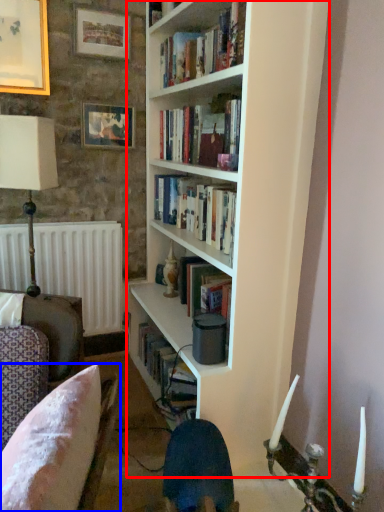
Question: Which object is closer to the camera taking this photo, bookcase (highlighted by a red box) or chair (highlighted by a blue box)?

Choices:
 (A) bookcase
 (B) chair

Answer: (B)